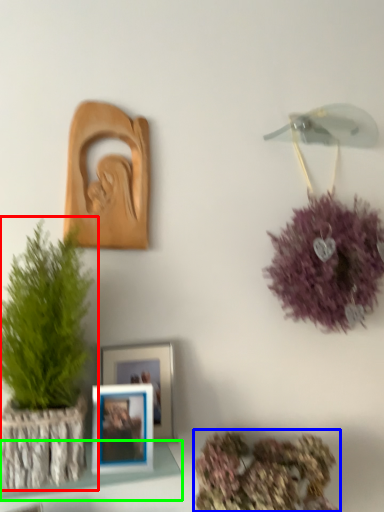
Question: Estimate the real-world distances between objects in this image. Which object is farther from houseplant (highlighted by a red box), floral arrangement (highlighted by a blue box) or shelf (highlighted by a green box)?

Choices:
 (A) floral arrangement
 (B) shelf

Answer: (A)